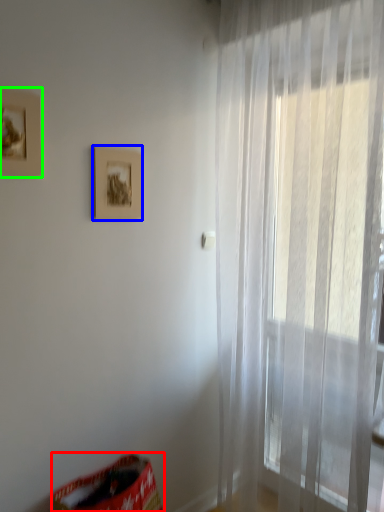
Question: Which is farther away from bean bag chair (highlighted by a red box)? picture frame (highlighted by a blue box) or picture frame (highlighted by a green box)?

Choices:
 (A) picture frame
 (B) picture frame

Answer: (B)